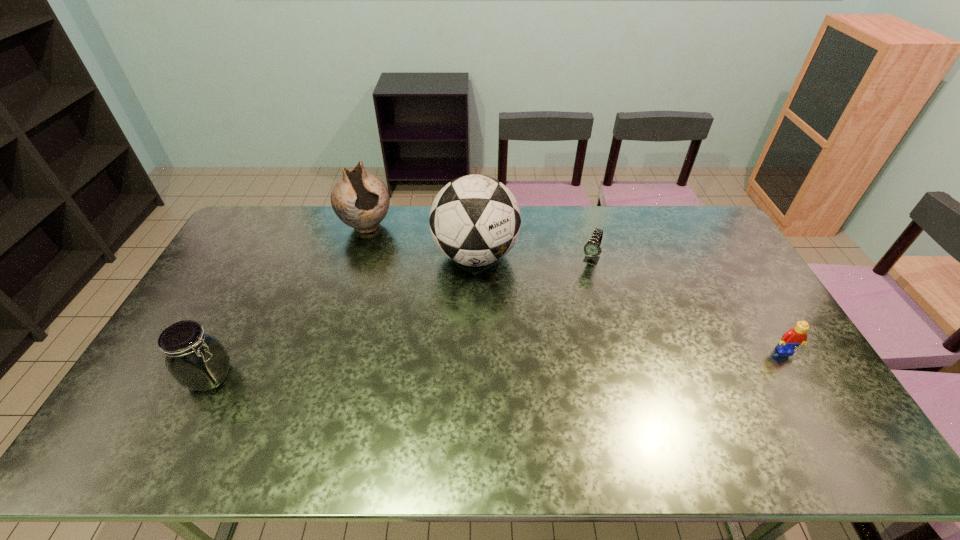
The image size is (960, 540). In order to click on unoccupied area between the second nearest object and the third object from left to right in this screenshot , I will do `click(630, 303)`.

This screenshot has width=960, height=540. I want to click on free spot between the watch and the second nearest object, so click(687, 305).

You are a GUI agent. You are given a task and a screenshot of the screen. Output one action in this format:
    pyautogui.click(x=<x>, y=<y>)
    Task: Click on the free space between the soccer ball and the nearest object
    This screenshot has width=960, height=540.
    Given the screenshot: What is the action you would take?
    pyautogui.click(x=343, y=316)

At what (x,y) coordinates should I click in order to perform the action: click on free spot between the second object from left to right and the Lego. Please return your answer as a coordinate pair (x, y). Looking at the image, I should click on (575, 288).

Locate an element on the screen. Image resolution: width=960 pixels, height=540 pixels. free space between the watch and the third object from right to left is located at coordinates (533, 258).

The image size is (960, 540). Find the location of `free point between the soccer ball and the watch`. free point between the soccer ball and the watch is located at coordinates (533, 258).

This screenshot has height=540, width=960. What are the coordinates of `free space between the third object from left to right and the rightmost object` in the screenshot? It's located at (630, 303).

Find the location of `vacant area that lies between the third object from right to left and the Lego`. vacant area that lies between the third object from right to left and the Lego is located at coordinates (630, 303).

I want to click on the closest object to the second nearest object, so click(592, 249).

Find the location of a particular element. Image resolution: width=960 pixels, height=540 pixels. object that can be found as the second closest to the third tallest object is located at coordinates (475, 220).